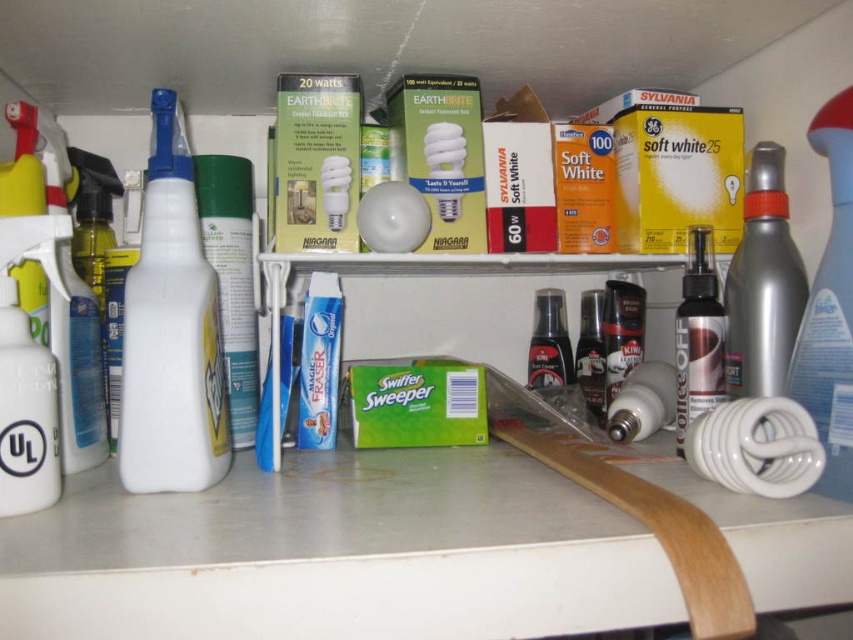
Which is more to the right, white glossy counter top at lower center or white plastic spray bottle at left?

white glossy counter top at lower center is more to the right.

Which is behind, point (837, 580) or point (178, 369)?

The point (178, 369) is more distant.

Between point (570, 602) and point (141, 298), which one is positioned in front?

Point (570, 602)

Where is `white glossy counter top at lower center`? white glossy counter top at lower center is located at coordinates (335, 554).

Based on the photo, who is higher up, silver metallic spray bottle at right or white matte spray bottle at left?

silver metallic spray bottle at right

Is silver metallic spray bottle at right to the right of white matte spray bottle at left from the viewer's perspective?

Correct, you'll find silver metallic spray bottle at right to the right of white matte spray bottle at left.

Find the location of a particular element. silver metallic spray bottle at right is located at coordinates (830, 308).

Which of these two, white plastic spray bottle at left or blue matte toothpaste at center, stands taller?

white plastic spray bottle at left

Does white plastic spray bottle at left appear on the left side of blue matte toothpaste at center?

Yes, white plastic spray bottle at left is to the left of blue matte toothpaste at center.

What do you see at coordinates (171, 332) in the screenshot?
I see `white plastic spray bottle at left` at bounding box center [171, 332].

Find the location of a particular element. This screenshot has height=640, width=853. white plastic spray bottle at left is located at coordinates (171, 332).